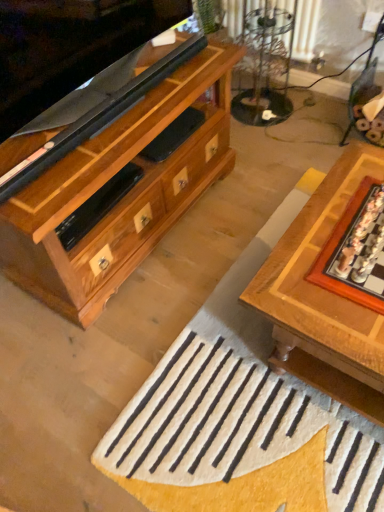
Where is `free space between clear glass table at upper center and white woolen doormat at center`? The height and width of the screenshot is (512, 384). free space between clear glass table at upper center and white woolen doormat at center is located at coordinates (238, 206).